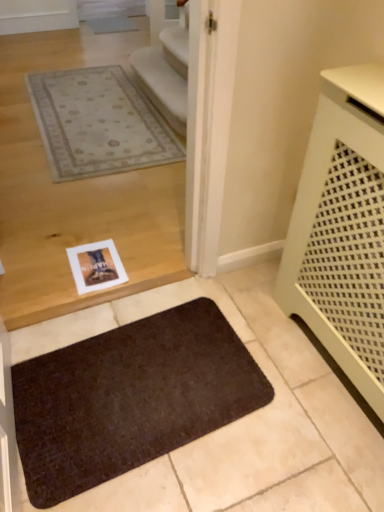
Identify the location of vacant region below brown textured mat at lower center (from a real-world perspective). (121, 419).